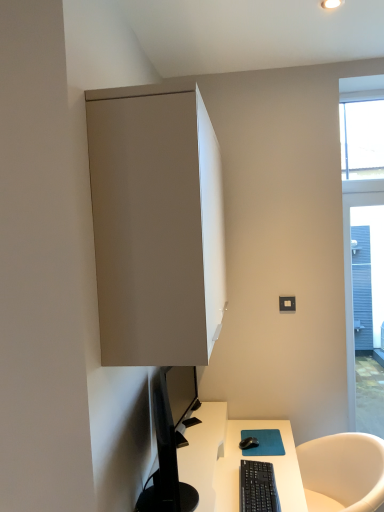
Question: Considering the relative sizes of black plastic keyboard at lower center and black matte mouse at lower center in the image provided, is black plastic keyboard at lower center thinner than black matte mouse at lower center?

Choices:
 (A) yes
 (B) no

Answer: (B)

Question: Considering the relative positions of black plastic keyboard at lower center and black matte mouse at lower center in the image provided, is black plastic keyboard at lower center to the left of black matte mouse at lower center from the viewer's perspective?

Choices:
 (A) no
 (B) yes

Answer: (B)

Question: Does black plastic keyboard at lower center come in front of black matte mouse at lower center?

Choices:
 (A) yes
 (B) no

Answer: (A)

Question: From a real-world perspective, is black plastic keyboard at lower center physically above black matte mouse at lower center?

Choices:
 (A) no
 (B) yes

Answer: (A)

Question: Considering the relative positions of black plastic keyboard at lower center and black matte mouse at lower center in the image provided, is black plastic keyboard at lower center to the right of black matte mouse at lower center from the viewer's perspective?

Choices:
 (A) yes
 (B) no

Answer: (B)

Question: From a real-world perspective, is black plastic keyboard at lower center physically below black matte mouse at lower center?

Choices:
 (A) yes
 (B) no

Answer: (A)

Question: From a real-world perspective, is white glossy desk at lower center positioned under matte gray cabinet at upper left based on gravity?

Choices:
 (A) yes
 (B) no

Answer: (A)

Question: Is white glossy desk at lower center positioned in front of matte gray cabinet at upper left?

Choices:
 (A) no
 (B) yes

Answer: (A)

Question: Is white glossy desk at lower center to the right of matte gray cabinet at upper left from the viewer's perspective?

Choices:
 (A) no
 (B) yes

Answer: (B)

Question: Is the depth of white glossy desk at lower center greater than that of matte gray cabinet at upper left?

Choices:
 (A) yes
 (B) no

Answer: (A)

Question: From the image's perspective, is white glossy desk at lower center on top of matte gray cabinet at upper left?

Choices:
 (A) no
 (B) yes

Answer: (A)

Question: Is white glossy desk at lower center not inside matte gray cabinet at upper left?

Choices:
 (A) yes
 (B) no

Answer: (A)

Question: Is black matte mouse at lower center smaller than black plastic keyboard at lower center?

Choices:
 (A) no
 (B) yes

Answer: (B)